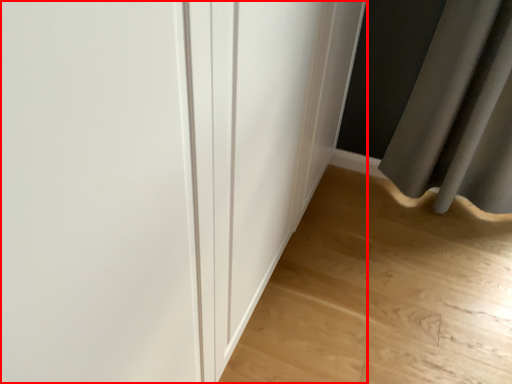
Question: From the image's perspective, where is door (annotated by the red box) located in relation to corridor in the image?

Choices:
 (A) below
 (B) above

Answer: (B)